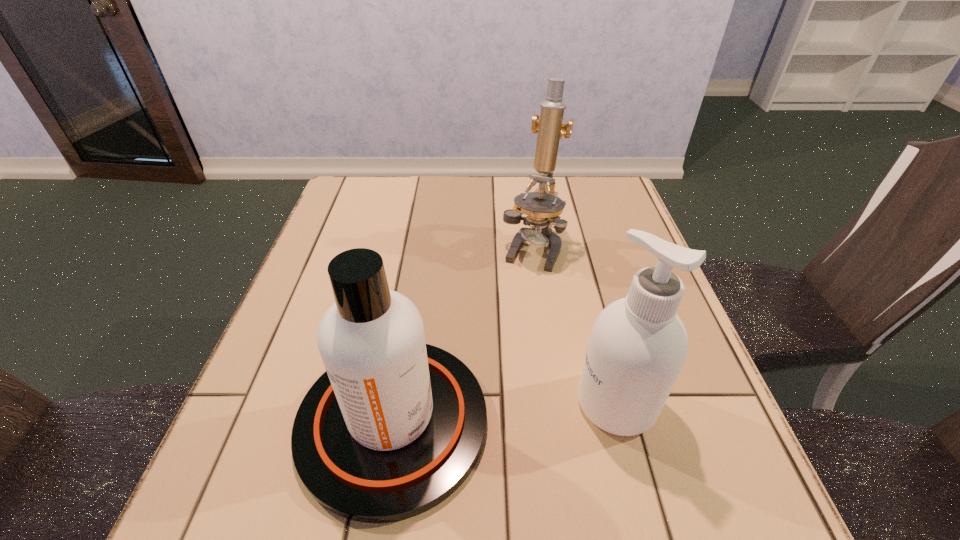
Find the location of `blank region between the leftmost object and the right cleansing agent`. blank region between the leftmost object and the right cleansing agent is located at coordinates (505, 412).

Find the location of a particular element. vacant point located between the right cleansing agent and the leftmost object is located at coordinates (505, 412).

Identify the location of vacant point located between the left cleansing agent and the right cleansing agent. (505, 412).

Locate an element on the screen. unoccupied position between the leftmost object and the right cleansing agent is located at coordinates (505, 412).

Where is `free area in between the microscope and the right cleansing agent`? free area in between the microscope and the right cleansing agent is located at coordinates (574, 325).

At what (x,y) coordinates should I click in order to perform the action: click on free space that is in between the left cleansing agent and the right cleansing agent. Please return your answer as a coordinate pair (x, y). The height and width of the screenshot is (540, 960). Looking at the image, I should click on (505, 412).

Image resolution: width=960 pixels, height=540 pixels. What are the coordinates of `vacant area that lies between the left cleansing agent and the farthest object` in the screenshot? It's located at (463, 335).

Find the location of a particular element. Image resolution: width=960 pixels, height=540 pixels. free point between the right cleansing agent and the farthest object is located at coordinates (574, 325).

The width and height of the screenshot is (960, 540). In order to click on object that ranks as the second closest to the right cleansing agent in this screenshot , I will do `click(543, 207)`.

Locate an element on the screen. The height and width of the screenshot is (540, 960). object identified as the closest to the right cleansing agent is located at coordinates (394, 426).